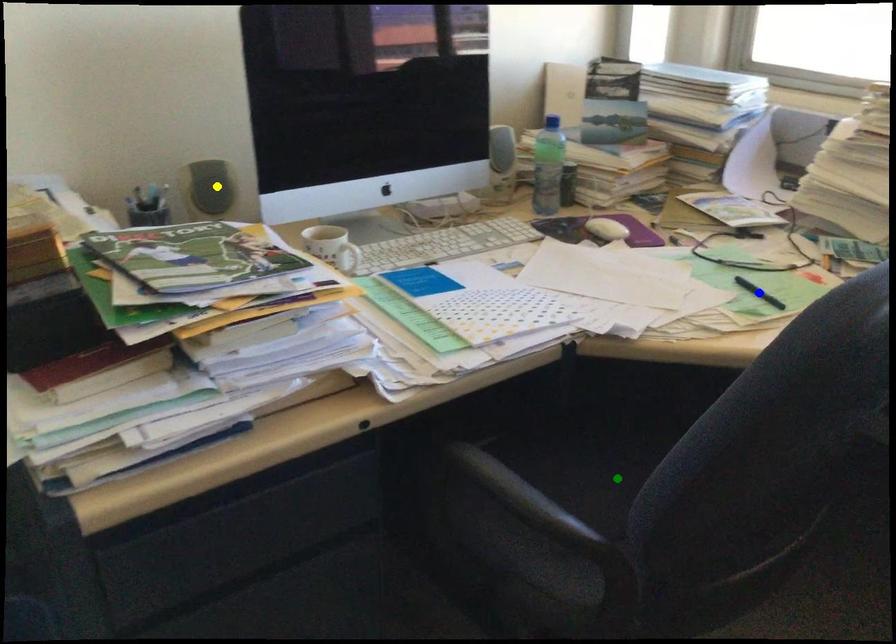
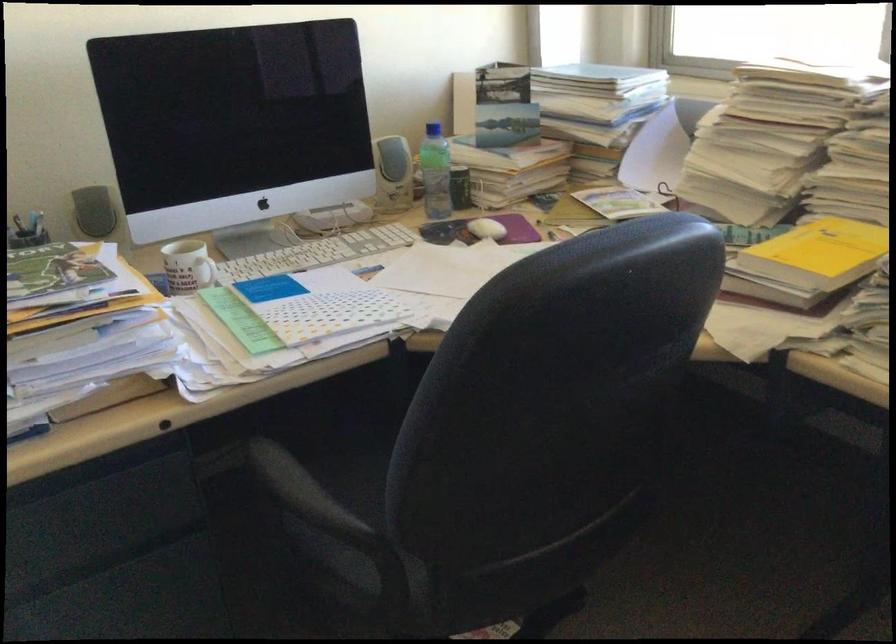
I am providing you with two images of the same scene from different viewpoints. Three points are marked in image1. Which point corresponds to a part or object that is occluded in image2?In image1, three points are marked. Which of them correspond to a part or object that is occluded in image2?Among the three points shown in image1, which one corresponds to a part or object that is no longer visible due to occlusion in image2?

green point, blue point cannot be seen in image2.